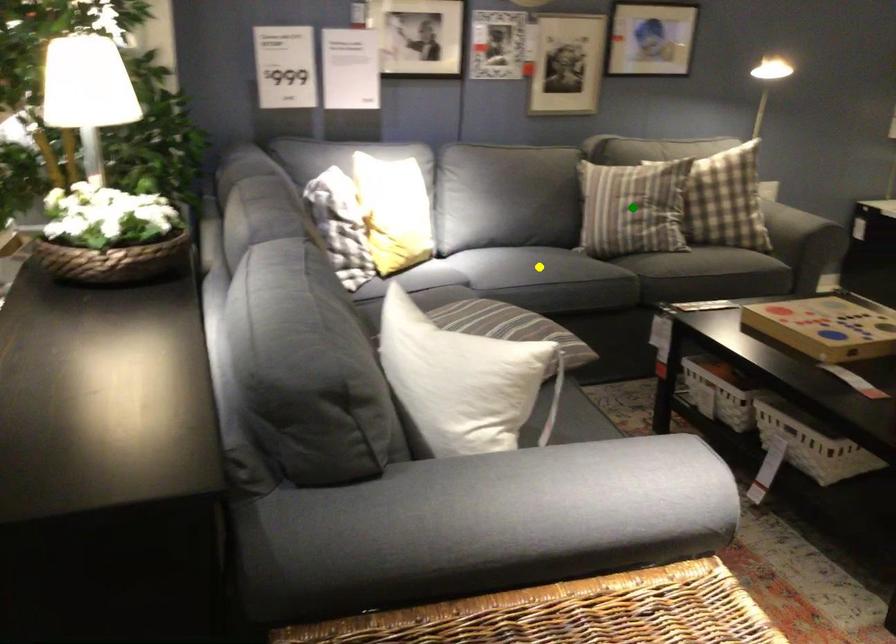
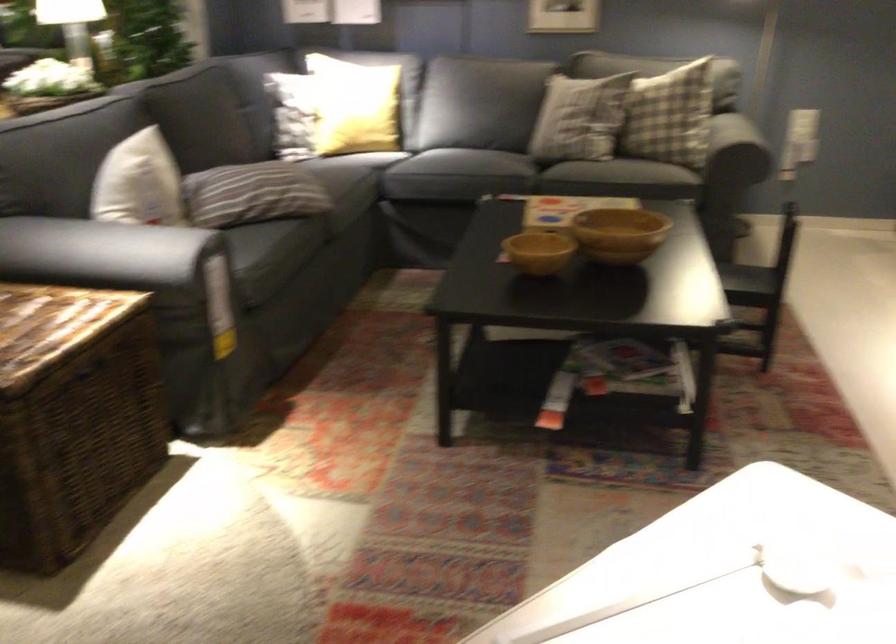
I am providing you with two images of the same scene from different viewpoints. Three points are marked in image1. Which point corresponds to a part or object that is occluded in image2?In image1, three points are marked. Which of them correspond to a part or object that is occluded in image2?Among the three points shown in image1, which one corresponds to a part or object that is no longer visible due to occlusion in image2?

Invisible in image2: yellow point, blue point, green point.